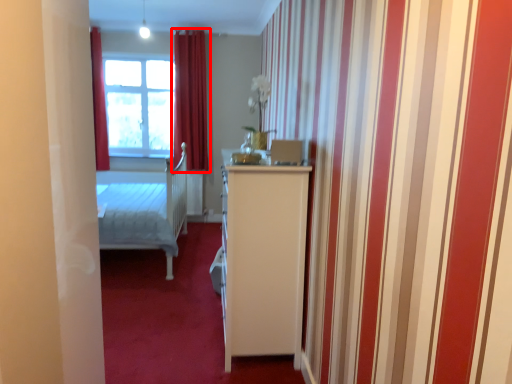
Question: Considering the relative positions of curtain (annotated by the red box) and window in the image provided, where is curtain (annotated by the red box) located with respect to the staircase?

Choices:
 (A) right
 (B) left

Answer: (A)